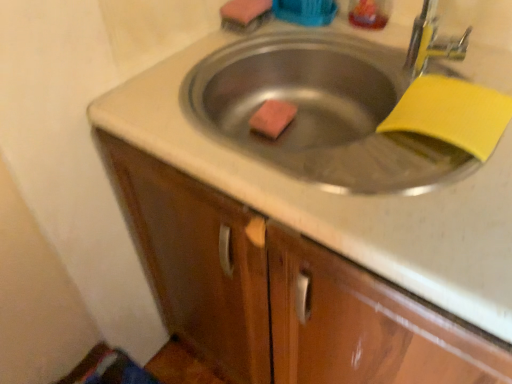
Question: Is wooden cabinet at center taller or shorter than translucent plastic liquid at upper right?

Choices:
 (A) short
 (B) tall

Answer: (B)

Question: Does point (303, 263) appear closer or farther from the camera than point (359, 8)?

Choices:
 (A) farther
 (B) closer

Answer: (B)

Question: Based on their relative distances, which object is nearer to the wooden cabinet at center?

Choices:
 (A) pink sponge at center, arranged as the 1th soap when ordered from the bottom
 (B) pink sponge at upper center, the second soap positioned from the bottom
 (C) translucent plastic liquid at upper right

Answer: (A)

Question: Which of these objects is positioned closest to the wooden cabinet at center?

Choices:
 (A) pink sponge at center, arranged as the 1th soap when ordered from the bottom
 (B) translucent plastic liquid at upper right
 (C) pink sponge at upper center, the second soap positioned from the bottom

Answer: (A)